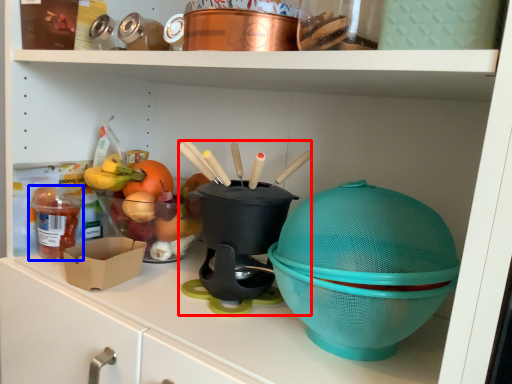
Question: Which object is further to the camera taking this photo, appliance (highlighted by a red box) or food (highlighted by a blue box)?

Choices:
 (A) appliance
 (B) food

Answer: (B)